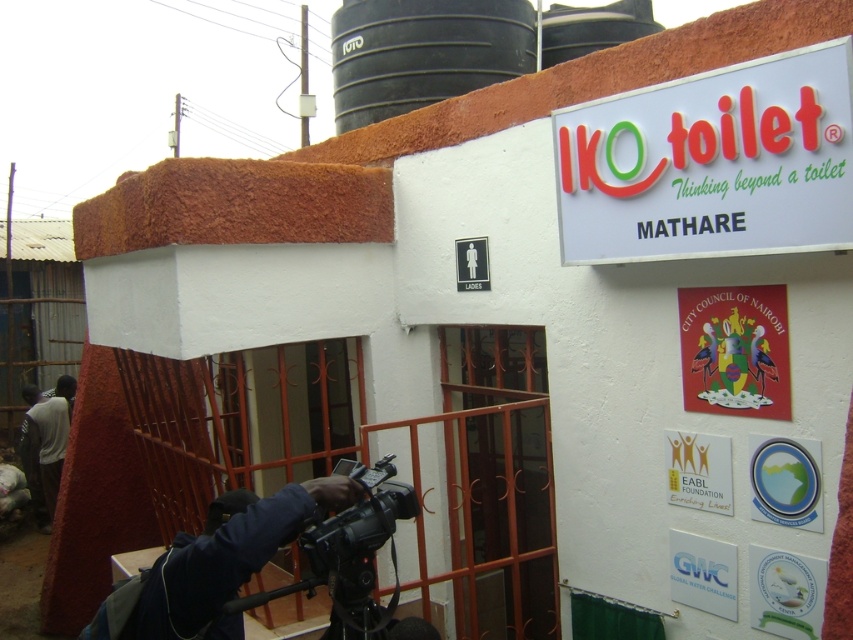
You are a visitor at the IKO toilet and want to take a photo of the white plastic sign at upper right and the black plastic video camera at lower center. Which object should you point your camera towards first if you want to capture both in one frame without moving the camera?

The white plastic sign at upper right is positioned on the right side of the black plastic video camera at lower center, so you should aim your camera towards the black plastic video camera at lower center first to include both in the frame.

You are standing in front of the building and want to locate the white plastic sign at upper right. Based on the coordinates given, where exactly should you look relative to the entrance?

The white plastic sign at upper right is located at the coordinates point (711, 163), which is to the upper right of the entrance.

Looking at this image, you are a security guard assigned to monitor the IKO toilet building. You have a black plastic video camera at lower center and a dark gray fabric shirt at lower left. Which object is smaller in size?

The black plastic video camera at lower center is smaller in size compared to the dark gray fabric shirt at lower left.